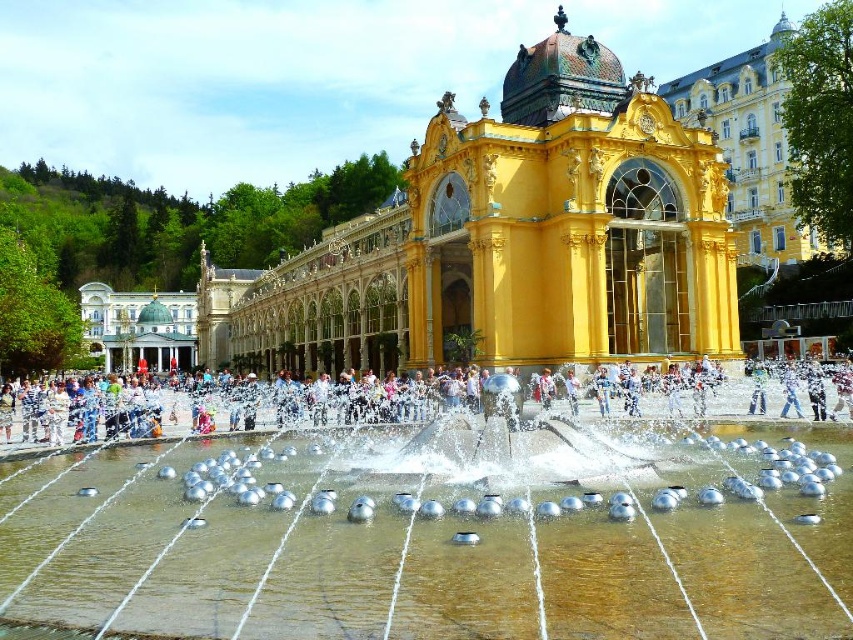
Question: Does silver metallic water at center come behind golden glass palace at center?

Choices:
 (A) no
 (B) yes

Answer: (A)

Question: Is golden glass palace at center wider than yellow/golden stone building at upper right?

Choices:
 (A) no
 (B) yes

Answer: (B)

Question: Which object is farther from the camera taking this photo?

Choices:
 (A) white cotton shirt at center
 (B) silver metallic water at center
 (C) yellow/golden stone building at upper right

Answer: (C)

Question: Which object is closer to the camera taking this photo?

Choices:
 (A) yellow/golden stone building at upper right
 (B) silver metallic water at center
 (C) golden glass palace at center

Answer: (B)

Question: Considering the relative positions of silver metallic water at center and white cotton shirt at center in the image provided, where is silver metallic water at center located with respect to white cotton shirt at center?

Choices:
 (A) above
 (B) below

Answer: (B)

Question: Which point is farther to the camera?

Choices:
 (A) (99, 596)
 (B) (788, 387)
 (C) (740, 250)

Answer: (C)